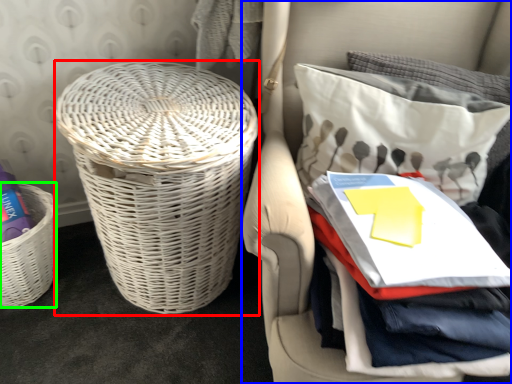
Question: Considering the real-world distances, which object is closest to basket (highlighted by a red box)? furniture (highlighted by a blue box) or basket (highlighted by a green box).

Choices:
 (A) furniture
 (B) basket

Answer: (A)